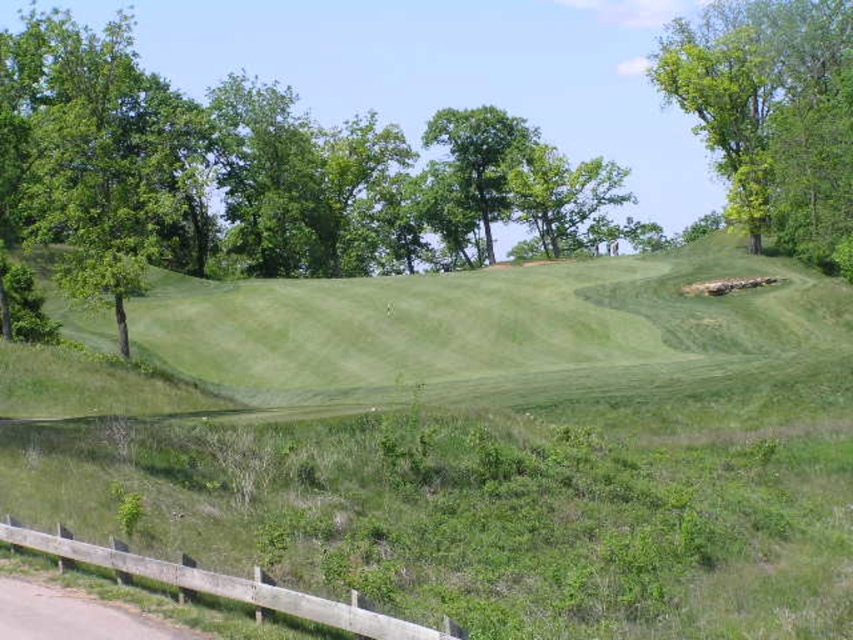
Question: Based on their relative distances, which object is farther from the green grassy hillside at center?

Choices:
 (A) green leafy tree at center
 (B) green leafy tree at left

Answer: (A)

Question: Is the position of green grassy hill at center less distant than that of green leafy tree at upper right?

Choices:
 (A) yes
 (B) no

Answer: (A)

Question: Is green leafy tree at upper right above green leafy tree at center?

Choices:
 (A) yes
 (B) no

Answer: (A)

Question: Which point is farther to the camera?

Choices:
 (A) (802, 244)
 (B) (248, 340)
 (C) (480, 216)
 (D) (71, 90)

Answer: (C)

Question: Can you confirm if green grassy hillside at center is wider than green leafy tree at left?

Choices:
 (A) yes
 (B) no

Answer: (B)

Question: Which point is closer to the camera taking this photo?

Choices:
 (A) (766, 74)
 (B) (10, 90)
 (C) (634, 388)
 (D) (462, 186)

Answer: (C)